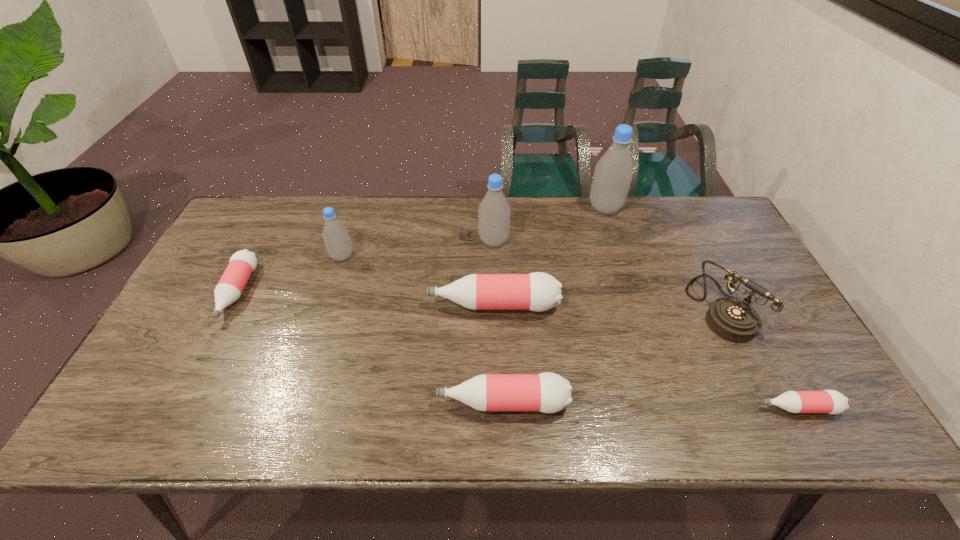
The height and width of the screenshot is (540, 960). Identify the location of the biggest gray bottle. (613, 174).

Where is `the farthest gray bottle`? The width and height of the screenshot is (960, 540). the farthest gray bottle is located at coordinates (613, 174).

I want to click on the second gray bottle from left to right, so click(x=494, y=211).

In order to click on the second smallest gray bottle in this screenshot , I will do `click(494, 211)`.

This screenshot has height=540, width=960. Find the location of `the sixth shortest object`. the sixth shortest object is located at coordinates (336, 238).

You are a GUI agent. You are given a task and a screenshot of the screen. Output one action in this format:
    pyautogui.click(x=<x>, y=<y>)
    Task: Click on the second bottle from left to right
    
    Given the screenshot: What is the action you would take?
    pyautogui.click(x=336, y=238)

Where is `telephone`? The height and width of the screenshot is (540, 960). telephone is located at coordinates (733, 319).

Locate an element on the screen. The width and height of the screenshot is (960, 540). the biggest pink bottle is located at coordinates (538, 291).

Find the location of a particular element. This screenshot has width=960, height=540. the fourth shortest object is located at coordinates (538, 291).

Locate an element on the screen. This screenshot has width=960, height=540. the third shortest object is located at coordinates (547, 392).